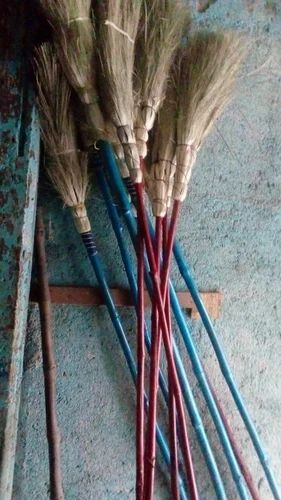
What are the coordinates of `broom` in the screenshot? It's located at (148, 179).